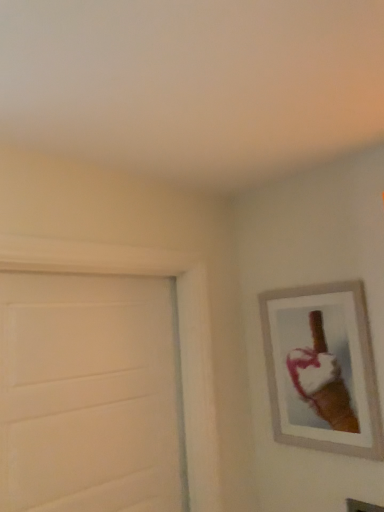
Question: Can you confirm if wooden picture frame at upper right is thinner than white matte door at left?

Choices:
 (A) yes
 (B) no

Answer: (A)

Question: Does wooden picture frame at upper right appear on the right side of white matte door at left?

Choices:
 (A) no
 (B) yes

Answer: (B)

Question: From a real-world perspective, is wooden picture frame at upper right positioned under white matte door at left based on gravity?

Choices:
 (A) no
 (B) yes

Answer: (A)

Question: Is the surface of wooden picture frame at upper right in direct contact with white matte door at left?

Choices:
 (A) yes
 (B) no

Answer: (B)

Question: Is the depth of wooden picture frame at upper right greater than that of white matte door at left?

Choices:
 (A) no
 (B) yes

Answer: (B)

Question: Is the position of wooden picture frame at upper right less distant than that of white matte door at left?

Choices:
 (A) yes
 (B) no

Answer: (B)

Question: Does white matte door at left have a lesser width compared to wooden picture frame at upper right?

Choices:
 (A) yes
 (B) no

Answer: (B)

Question: Is white matte door at left next to wooden picture frame at upper right and touching it?

Choices:
 (A) no
 (B) yes

Answer: (A)

Question: Is white matte door at left smaller than wooden picture frame at upper right?

Choices:
 (A) no
 (B) yes

Answer: (A)

Question: From a real-world perspective, is white matte door at left over wooden picture frame at upper right?

Choices:
 (A) no
 (B) yes

Answer: (A)

Question: Is white matte door at left positioned in front of wooden picture frame at upper right?

Choices:
 (A) yes
 (B) no

Answer: (A)

Question: Considering the relative sizes of white matte door at left and wooden picture frame at upper right in the image provided, is white matte door at left shorter than wooden picture frame at upper right?

Choices:
 (A) yes
 (B) no

Answer: (B)

Question: From a real-world perspective, relative to wooden picture frame at upper right, is white matte door at left vertically above or below?

Choices:
 (A) below
 (B) above

Answer: (A)